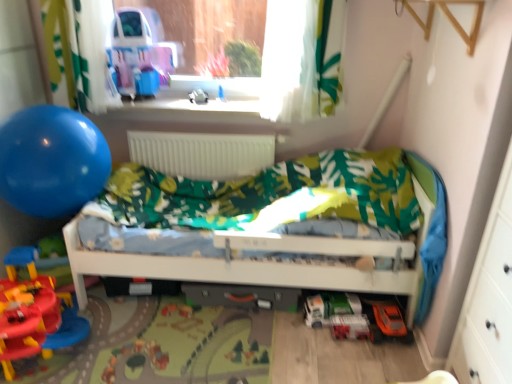
This screenshot has height=384, width=512. I want to click on free space above green matte toy car at lower center, which is the third toy in right-to-left order (from a real-world perspective), so click(x=335, y=300).